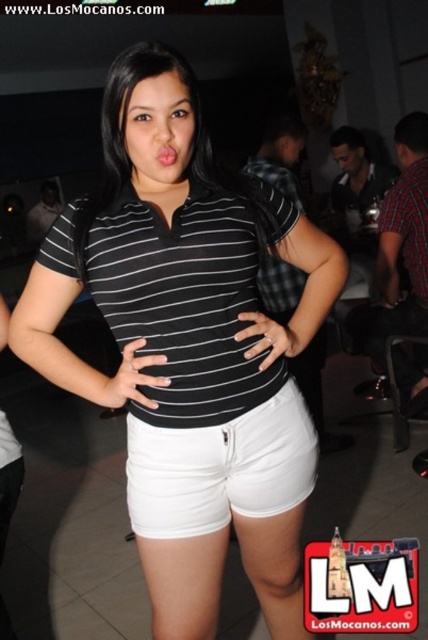
Does black striped polo shirt at center have a lesser height compared to white cotton shorts at center?

In fact, black striped polo shirt at center may be taller than white cotton shorts at center.

At what (x,y) coordinates should I click in order to perform the action: click on black striped polo shirt at center. Please return your answer as a coordinate pair (x, y). This screenshot has height=640, width=428. Looking at the image, I should click on (184, 301).

Who is more forward, (258,353) or (237,467)?

Positioned in front is point (258,353).

Does point (204, 250) lie in front of point (231, 420)?

That is True.

Find the location of a particular element. This screenshot has height=640, width=428. matte black polo shirt at center is located at coordinates (174, 275).

Is matte black polo shirt at center smaller than black striped polo shirt at center?

No, matte black polo shirt at center is not smaller than black striped polo shirt at center.

Which is above, matte black polo shirt at center or black striped polo shirt at center?

black striped polo shirt at center

Between point (193, 604) and point (50, 257), which one is positioned in front?

Point (50, 257)

Where is `matte black polo shirt at center`? The height and width of the screenshot is (640, 428). matte black polo shirt at center is located at coordinates (174, 275).